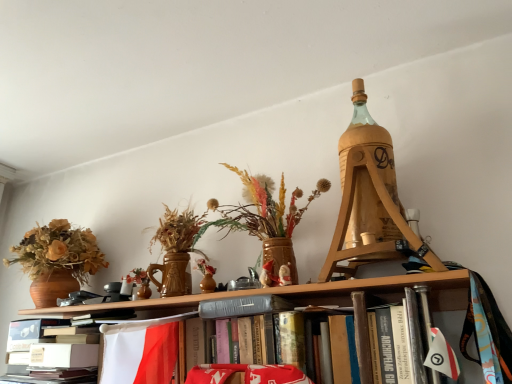
Question: Can you confirm if gray fabric bookshelf at center is thinner than white paper at lower left?

Choices:
 (A) no
 (B) yes

Answer: (B)

Question: Considering the relative positions of gray fabric bookshelf at center and white paper at lower left in the image provided, is gray fabric bookshelf at center to the right of white paper at lower left from the viewer's perspective?

Choices:
 (A) no
 (B) yes

Answer: (B)

Question: From a real-world perspective, is gray fabric bookshelf at center positioned over white paper at lower left based on gravity?

Choices:
 (A) no
 (B) yes

Answer: (B)

Question: Is gray fabric bookshelf at center at the left side of white paper at lower left?

Choices:
 (A) yes
 (B) no

Answer: (B)

Question: Is gray fabric bookshelf at center facing towards white paper at lower left?

Choices:
 (A) no
 (B) yes

Answer: (A)

Question: Does gray fabric bookshelf at center have a greater width compared to white paper at lower left?

Choices:
 (A) no
 (B) yes

Answer: (A)

Question: From the image's perspective, would you say wooden tripod at upper right is shown under white paper at lower left?

Choices:
 (A) yes
 (B) no

Answer: (B)

Question: Is wooden tripod at upper right oriented away from white paper at lower left?

Choices:
 (A) yes
 (B) no

Answer: (B)

Question: Considering the relative sizes of wooden tripod at upper right and white paper at lower left in the image provided, is wooden tripod at upper right thinner than white paper at lower left?

Choices:
 (A) no
 (B) yes

Answer: (A)

Question: From a real-world perspective, is wooden tripod at upper right located beneath white paper at lower left?

Choices:
 (A) no
 (B) yes

Answer: (A)

Question: Does wooden tripod at upper right contain white paper at lower left?

Choices:
 (A) no
 (B) yes

Answer: (A)

Question: Considering the relative sizes of wooden tripod at upper right and white paper at lower left in the image provided, is wooden tripod at upper right wider than white paper at lower left?

Choices:
 (A) no
 (B) yes

Answer: (B)

Question: Is the surface of wooden tripod at upper right in direct contact with gray fabric bookshelf at center?

Choices:
 (A) no
 (B) yes

Answer: (A)